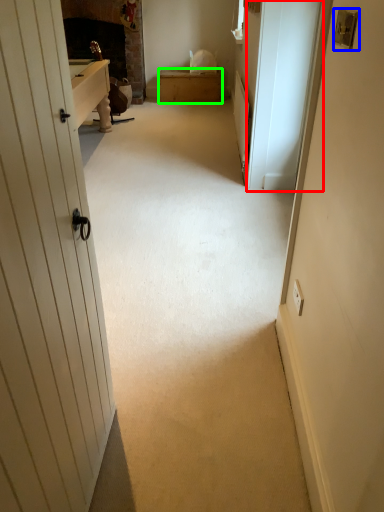
Question: Which is farther away from screen door (highlighted by a red box)? lock (highlighted by a blue box) or furniture (highlighted by a green box)?

Choices:
 (A) lock
 (B) furniture

Answer: (B)